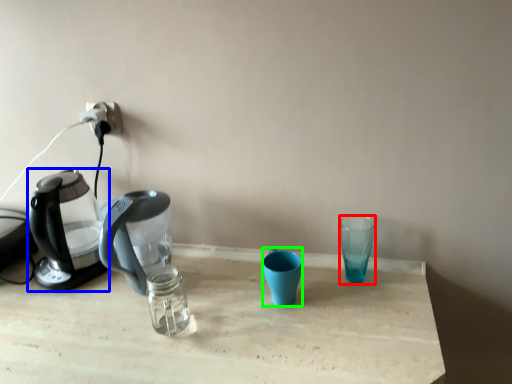
Question: Based on their relative distances, which object is farther from coffee cup (highlighted by a red box)? Choose from kettle (highlighted by a blue box) and coffee cup (highlighted by a green box).

Choices:
 (A) kettle
 (B) coffee cup

Answer: (A)